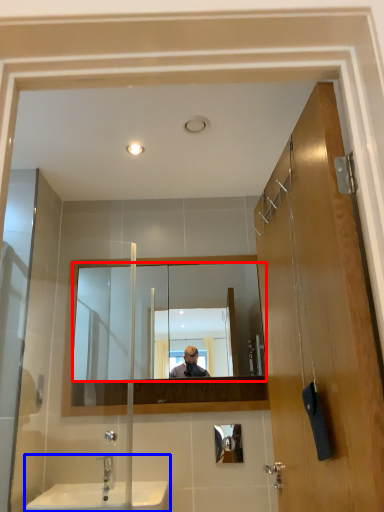
Question: Which point is closer to the camera, mirror (highlighted by a red box) or sink (highlighted by a blue box)?

Choices:
 (A) mirror
 (B) sink

Answer: (B)